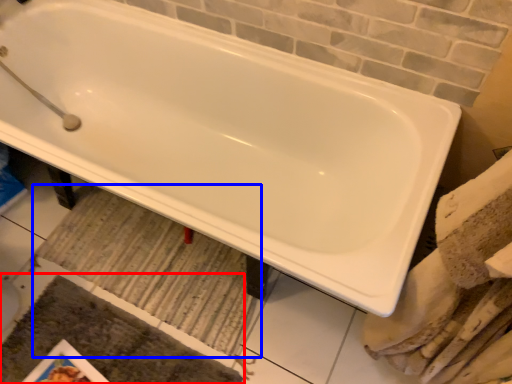
Question: Among these objects, which one is farthest to the camera, bath mat (highlighted by a red box) or bath mat (highlighted by a blue box)?

Choices:
 (A) bath mat
 (B) bath mat

Answer: (B)